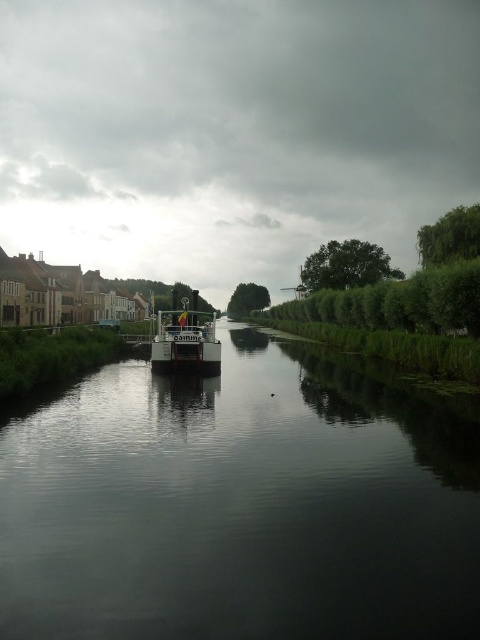
You are a tourist standing on the left side of the canal and want to take a photo of the white glossy boat at center. Since the dark reflective water at center is in front of the boat, will the water reflect the boat in your photo?

The dark reflective water at center is in front of the white glossy boat at center, so the water will reflect the boat in your photo.